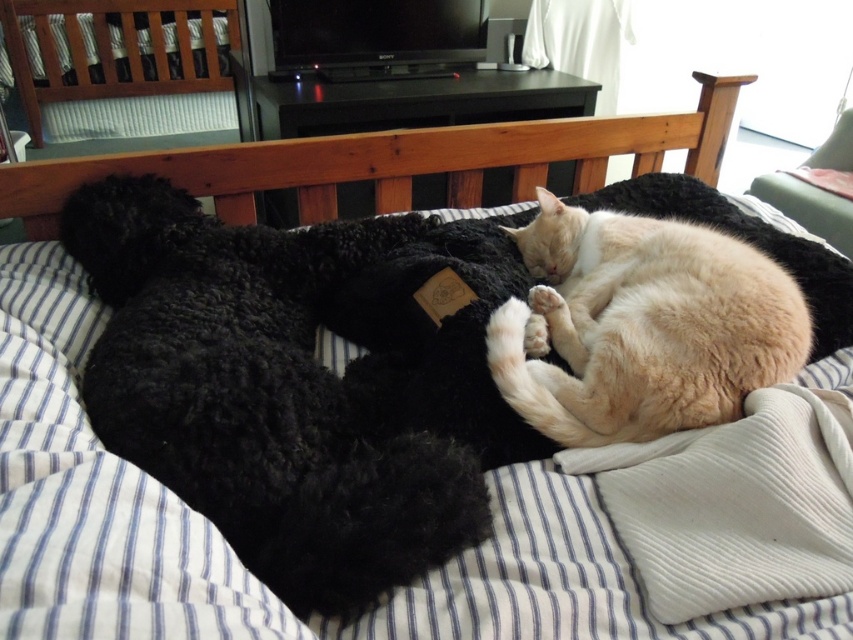
You are standing in the room and see two points marked on the wall. The first point is at coordinates point (99, 413) and the second is at point (653, 376). If you want to touch the point that is closer to you, which coordinate should you choose?

Point (99, 413) is in front of point (653, 376), so you should choose point (99, 413) as it is closer to you.

You are a photographer trying to capture a clear photo of both the black fluffy dog at left and the light beige fur cat at center. Since the dog is taller, which animal should you focus on first to ensure both are in focus?

The black fluffy dog at left is much taller than the light beige fur cat at center, so you should focus on the black fluffy dog at left first to ensure both are in focus.